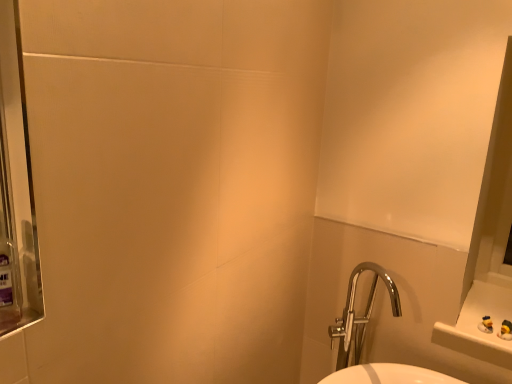
Question: Considering the relative positions of chrome metallic sink at lower right and translucent purple mouthwash at left in the image provided, is chrome metallic sink at lower right to the left of translucent purple mouthwash at left from the viewer's perspective?

Choices:
 (A) yes
 (B) no

Answer: (B)

Question: Is chrome metallic sink at lower right looking in the opposite direction of translucent purple mouthwash at left?

Choices:
 (A) yes
 (B) no

Answer: (B)

Question: Does chrome metallic sink at lower right have a greater height compared to translucent purple mouthwash at left?

Choices:
 (A) yes
 (B) no

Answer: (A)

Question: Does chrome metallic sink at lower right come behind translucent purple mouthwash at left?

Choices:
 (A) yes
 (B) no

Answer: (A)

Question: Is chrome metallic sink at lower right positioned beyond the bounds of translucent purple mouthwash at left?

Choices:
 (A) yes
 (B) no

Answer: (A)

Question: Is chrome metallic sink at lower right far from translucent purple mouthwash at left?

Choices:
 (A) yes
 (B) no

Answer: (A)

Question: Is the position of translucent purple mouthwash at left more distant than that of chrome metallic sink at lower right?

Choices:
 (A) yes
 (B) no

Answer: (B)

Question: Is translucent purple mouthwash at left positioned before chrome metallic sink at lower right?

Choices:
 (A) no
 (B) yes

Answer: (B)

Question: Is translucent purple mouthwash at left to the left of chrome metallic sink at lower right from the viewer's perspective?

Choices:
 (A) yes
 (B) no

Answer: (A)

Question: Does translucent purple mouthwash at left have a larger size compared to chrome metallic sink at lower right?

Choices:
 (A) no
 (B) yes

Answer: (A)

Question: From the image's perspective, does translucent purple mouthwash at left appear higher than chrome metallic sink at lower right?

Choices:
 (A) yes
 (B) no

Answer: (A)

Question: Is translucent purple mouthwash at left oriented towards chrome metallic sink at lower right?

Choices:
 (A) no
 (B) yes

Answer: (A)

Question: From a real-world perspective, is translucent purple mouthwash at left above or below chrome metallic sink at lower right?

Choices:
 (A) below
 (B) above

Answer: (B)